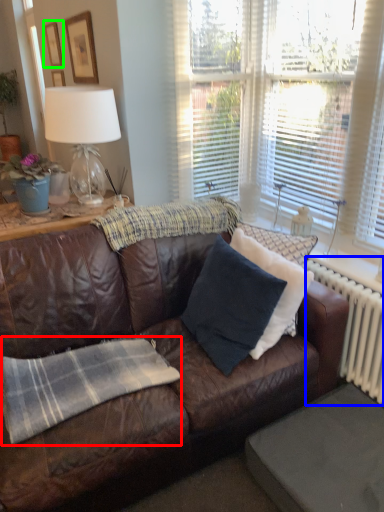
Question: Which object is the farthest from plaid (highlighted by a red box)? Choose among these: radiator (highlighted by a blue box) or picture frame (highlighted by a green box).

Choices:
 (A) radiator
 (B) picture frame

Answer: (B)